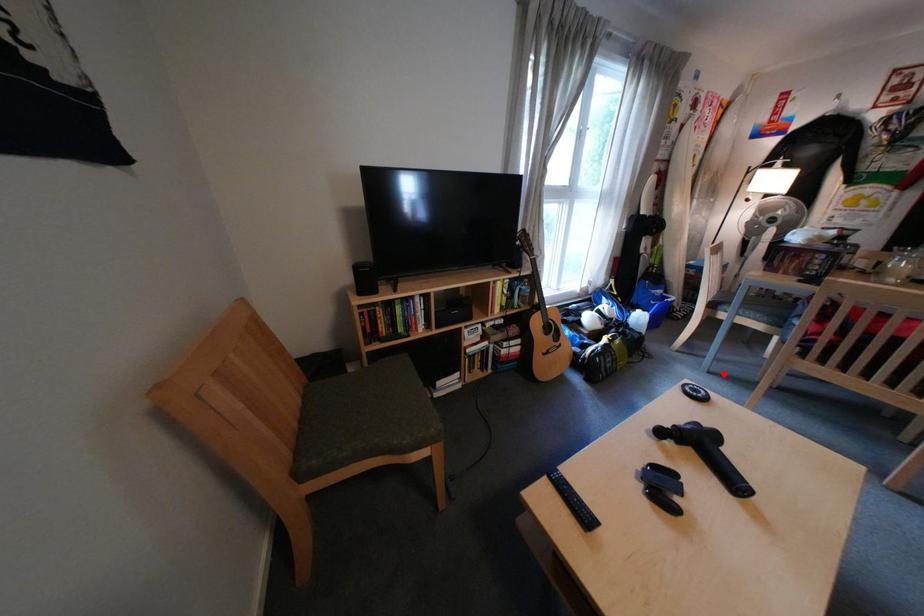
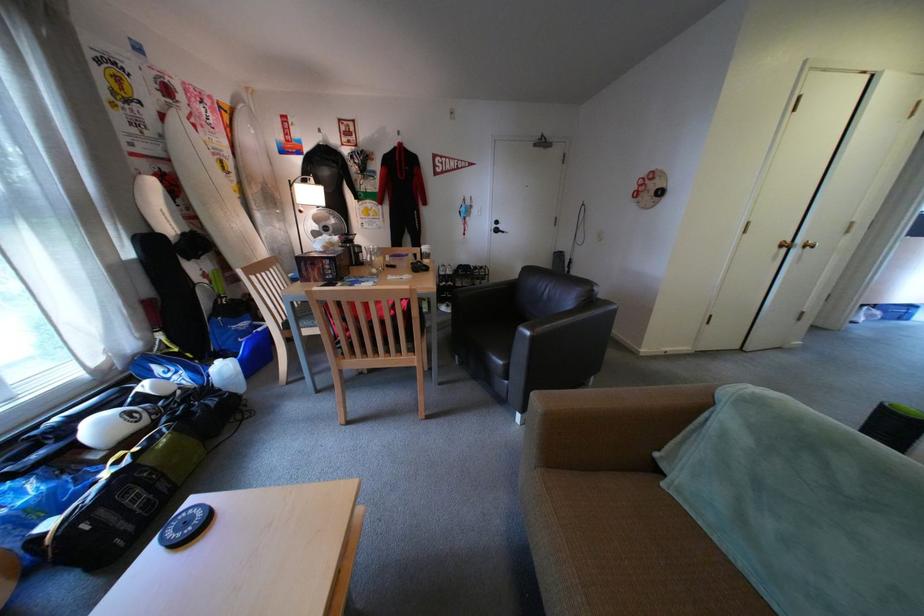
The point at the highlighted location is marked in the first image. Where is the corresponding point in the second image?

(333, 392)